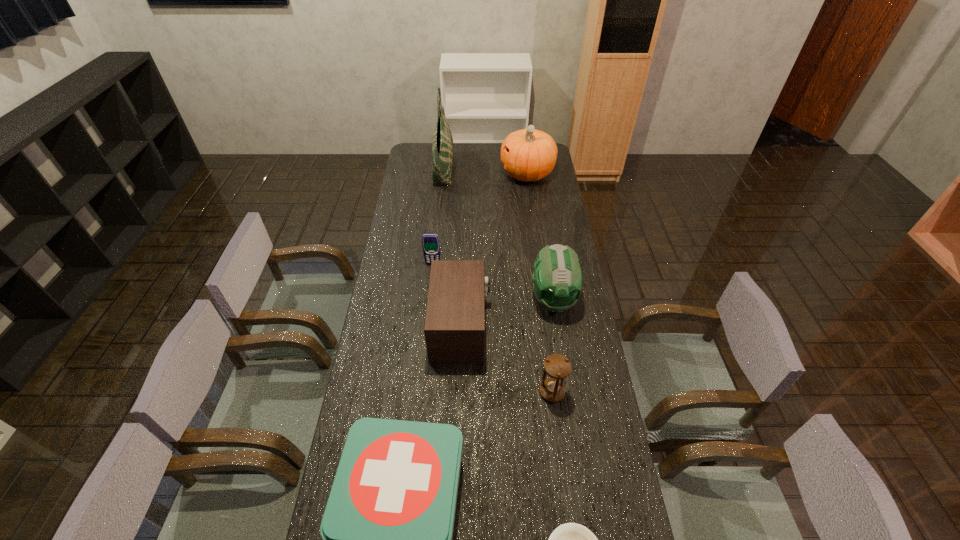
You are a GUI agent. You are given a task and a screenshot of the screen. Output one action in this format:
    pyautogui.click(x=<x>, y=<y>)
    Task: Click on the tallest object
    
    Given the screenshot: What is the action you would take?
    pyautogui.click(x=442, y=143)

You are a GUI agent. You are given a task and a screenshot of the screen. Output one action in this format:
    pyautogui.click(x=<x>, y=<y>)
    Task: Click on the second tallest object
    Image resolution: width=960 pixels, height=540 pixels.
    Given the screenshot: What is the action you would take?
    pyautogui.click(x=528, y=155)

At what (x,y) coordinates should I click in order to perform the action: click on football helmet. Please return your answer as a coordinate pair (x, y). Looking at the image, I should click on (x=557, y=279).

Locate an element on the screen. radio receiver is located at coordinates (454, 329).

This screenshot has width=960, height=540. In order to click on the third nearest object in this screenshot , I will do `click(557, 366)`.

Where is `cellular telephone`? Image resolution: width=960 pixels, height=540 pixels. cellular telephone is located at coordinates (431, 247).

The image size is (960, 540). Find the location of `vacant area located on the front of the tote bag`. vacant area located on the front of the tote bag is located at coordinates [x=439, y=207].

What are the coordinates of `free region located 0.160m on the front-facing side of the seventh shortest object` in the screenshot? It's located at (468, 174).

Where is `vacant position located 0.140m on the front-facing side of the seventh shortest object`? vacant position located 0.140m on the front-facing side of the seventh shortest object is located at coordinates (472, 174).

Find the location of a particular element. free location located 0.340m on the front-facing side of the seventh shortest object is located at coordinates (434, 174).